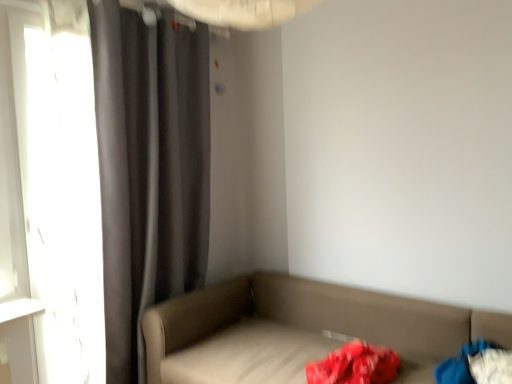
Question: From the image's perspective, is dark gray fabric curtain at left over blue fabric bag at lower right?

Choices:
 (A) yes
 (B) no

Answer: (A)

Question: From a real-world perspective, is dark gray fabric curtain at left physically below blue fabric bag at lower right?

Choices:
 (A) yes
 (B) no

Answer: (B)

Question: Is dark gray fabric curtain at left turned away from blue fabric bag at lower right?

Choices:
 (A) no
 (B) yes

Answer: (A)

Question: From a real-world perspective, is dark gray fabric curtain at left over blue fabric bag at lower right?

Choices:
 (A) no
 (B) yes

Answer: (B)

Question: Does dark gray fabric curtain at left appear on the right side of blue fabric bag at lower right?

Choices:
 (A) no
 (B) yes

Answer: (A)

Question: Considering the positions of blue fabric bag at lower right and dark gray fabric curtain at left in the image, is blue fabric bag at lower right bigger or smaller than dark gray fabric curtain at left?

Choices:
 (A) small
 (B) big

Answer: (A)

Question: Relative to dark gray fabric curtain at left, is blue fabric bag at lower right in front or behind?

Choices:
 (A) front
 (B) behind

Answer: (A)

Question: Is blue fabric bag at lower right to the left or to the right of dark gray fabric curtain at left in the image?

Choices:
 (A) left
 (B) right

Answer: (B)

Question: From a real-world perspective, relative to dark gray fabric curtain at left, is blue fabric bag at lower right vertically above or below?

Choices:
 (A) below
 (B) above

Answer: (A)

Question: From the image's perspective, is leatherette studio couch at lower right above or below blue fabric bag at lower right?

Choices:
 (A) below
 (B) above

Answer: (A)

Question: Is leatherette studio couch at lower right inside the boundaries of blue fabric bag at lower right, or outside?

Choices:
 (A) inside
 (B) outside

Answer: (B)

Question: Considering the positions of leatherette studio couch at lower right and blue fabric bag at lower right in the image, is leatherette studio couch at lower right wider or thinner than blue fabric bag at lower right?

Choices:
 (A) wide
 (B) thin

Answer: (A)

Question: Considering the positions of point (437, 316) and point (446, 379), is point (437, 316) closer or farther from the camera than point (446, 379)?

Choices:
 (A) closer
 (B) farther

Answer: (B)

Question: Considering the positions of blue fabric bag at lower right and transparent glass window at left in the image, is blue fabric bag at lower right taller or shorter than transparent glass window at left?

Choices:
 (A) tall
 (B) short

Answer: (B)

Question: In terms of width, does blue fabric bag at lower right look wider or thinner when compared to transparent glass window at left?

Choices:
 (A) wide
 (B) thin

Answer: (A)